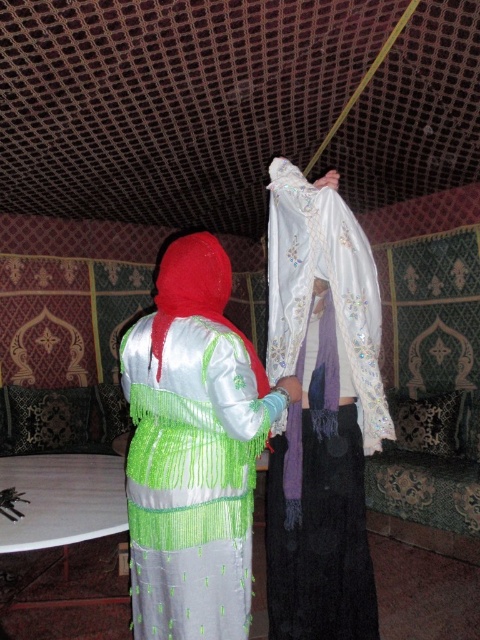
Between white embroidered scarf at center and satin silk dress at center, which one appears on the right side from the viewer's perspective?

white embroidered scarf at center is more to the right.

Locate an element on the screen. white embroidered scarf at center is located at coordinates (321, 412).

The image size is (480, 640). In order to click on white embroidered scarf at center in this screenshot , I will do `click(321, 412)`.